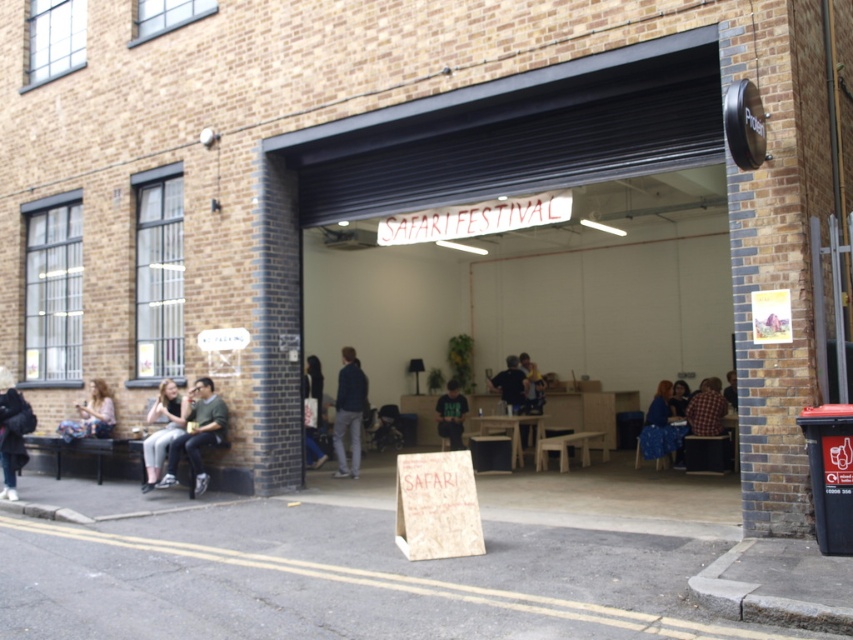
Question: Which is farther from the dark blue shirt at center?

Choices:
 (A) blue fabric chair at lower right
 (B) plaid fabric shirt at center-right
 (C) matte black shirt at center

Answer: (B)

Question: Is plaid fabric shirt at center-right wider than green fabric shirt at center?

Choices:
 (A) yes
 (B) no

Answer: (A)

Question: Considering the relative positions of matte green shirt at left and light brown leather jacket at lower left in the image provided, where is matte green shirt at left located with respect to light brown leather jacket at lower left?

Choices:
 (A) below
 (B) above

Answer: (B)

Question: Can you confirm if dark gray jacket at left is positioned to the left of green fabric shirt at center?

Choices:
 (A) no
 (B) yes

Answer: (B)

Question: Which object is farther from the camera taking this photo?

Choices:
 (A) dark blue jeans at center
 (B) dark blue jacket at center

Answer: (A)

Question: Which point is closer to the camera?

Choices:
 (A) blue fabric chair at lower right
 (B) green fabric shirt at center

Answer: (A)